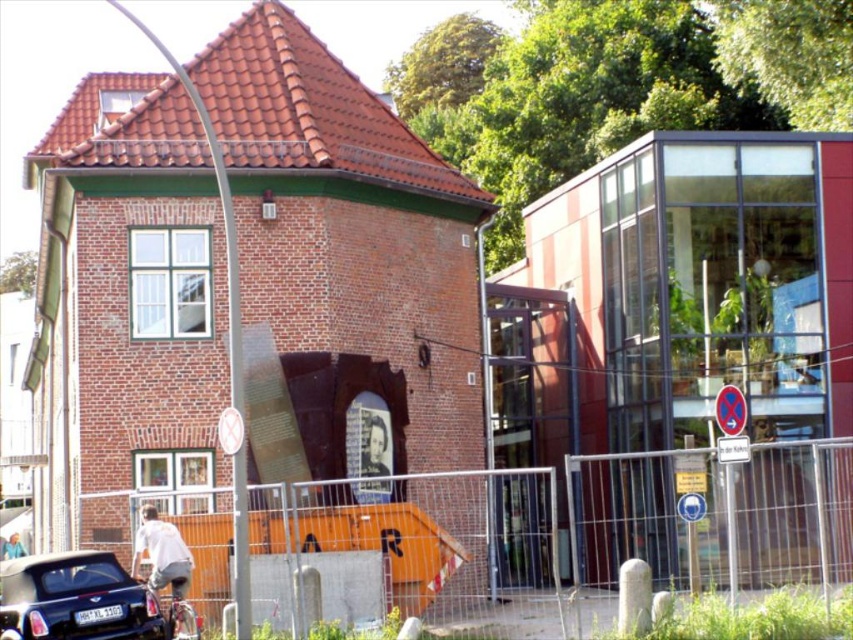
In the scene shown: Can you confirm if metal fence at lower left is shorter than shiny black car at lower left?

No, metal fence at lower left is not shorter than shiny black car at lower left.

Describe the element at coordinates (582, 529) in the screenshot. I see `metal fence at lower left` at that location.

Identify the location of metal fence at lower left. Image resolution: width=853 pixels, height=640 pixels. (582, 529).